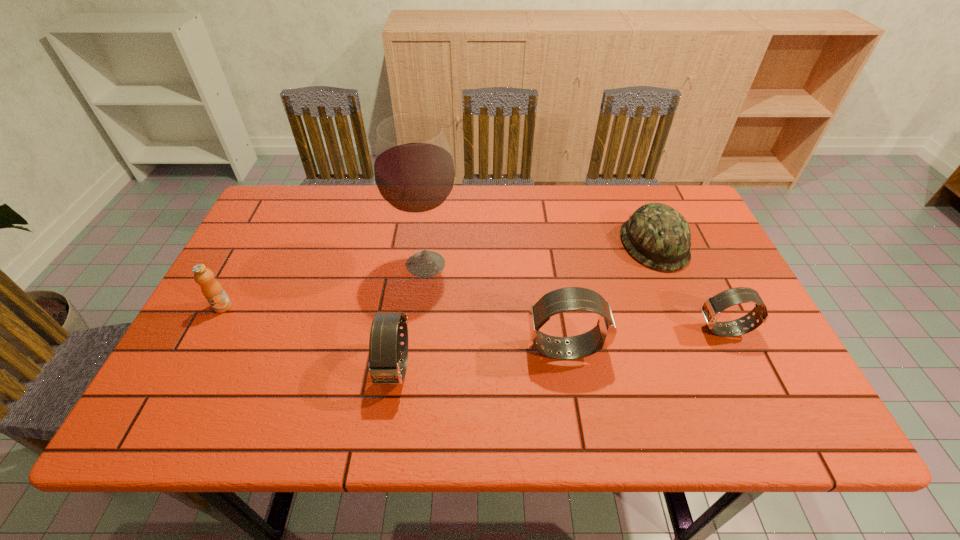
The image size is (960, 540). Identify the location of free region at the near edge of the desktop. coord(250,375).

In the image, there is a desktop. Identify the location of blank space at the left edge. Image resolution: width=960 pixels, height=540 pixels. (277, 246).

At what (x,y) coordinates should I click in order to perform the action: click on vacant region at the right edge of the desktop. Please return your answer as a coordinate pair (x, y). Looking at the image, I should click on (693, 267).

Where is `blank space at the near left corner of the desktop`? The width and height of the screenshot is (960, 540). blank space at the near left corner of the desktop is located at coordinates (192, 369).

Locate an element on the screen. The image size is (960, 540). vacant space at the far right corner of the desktop is located at coordinates (654, 185).

I want to click on vacant position at the near right corner of the desktop, so click(x=720, y=389).

Image resolution: width=960 pixels, height=540 pixels. In order to click on vacant area that lies between the headwear and the second shortest watch in this screenshot , I will do `click(525, 306)`.

Find the location of a particular element. This screenshot has height=540, width=960. empty location between the rightmost watch and the orange juice is located at coordinates (473, 319).

This screenshot has width=960, height=540. Identify the location of free spot between the fourth nearest object and the leftmost watch. (309, 337).

Identify the location of vacant space in between the leftmost object and the alcohol. Image resolution: width=960 pixels, height=540 pixels. (324, 285).